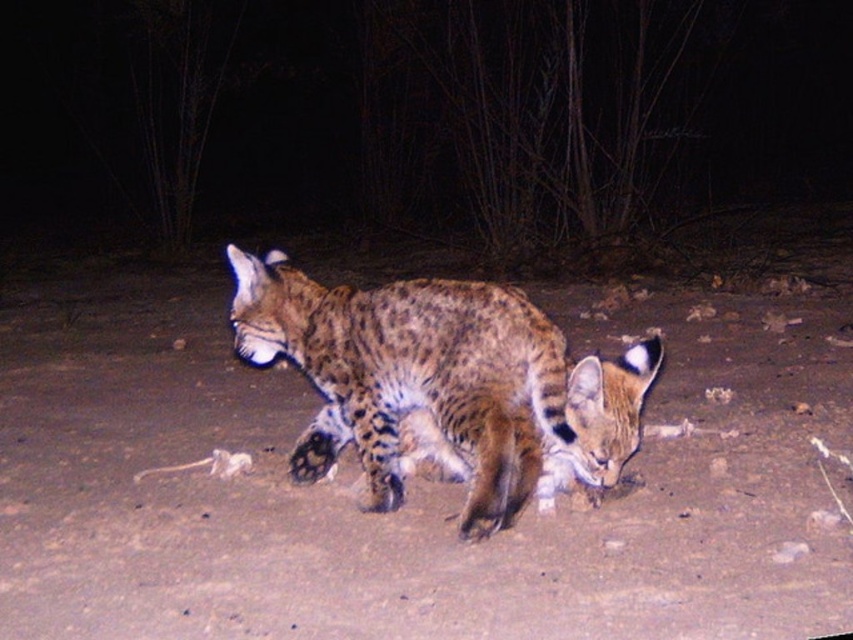
Is brown sandy dirt at center to the right of spotted fur cat at center from the viewer's perspective?

Incorrect, brown sandy dirt at center is not on the right side of spotted fur cat at center.

Find the location of a particular element. Image resolution: width=853 pixels, height=640 pixels. brown sandy dirt at center is located at coordinates (405, 486).